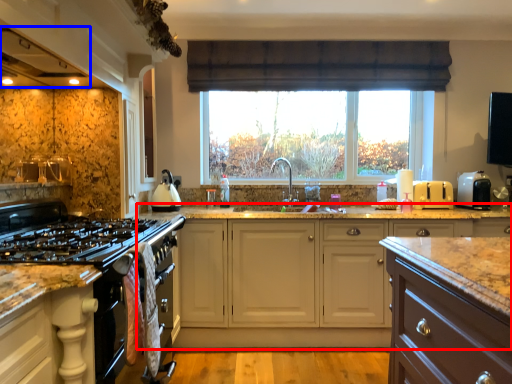
Question: Among these objects, which one is nearest to the camera, cabinetry (highlighted by a red box) or exhaust hood (highlighted by a blue box)?

Choices:
 (A) cabinetry
 (B) exhaust hood

Answer: (B)